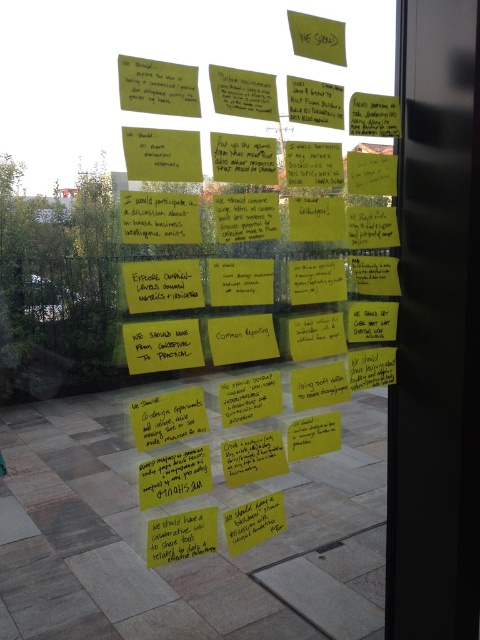
Who is positioned more to the right, yellow sticky notes at upper center or yellow sticky notes at right?

yellow sticky notes at right

From the picture: Which is above, yellow sticky notes at upper center or yellow sticky notes at right?

yellow sticky notes at upper center is above.

Which is behind, point (205, 216) or point (478, 145)?

Point (478, 145)

The height and width of the screenshot is (640, 480). In order to click on yellow sticky notes at upper center in this screenshot , I will do `click(254, 244)`.